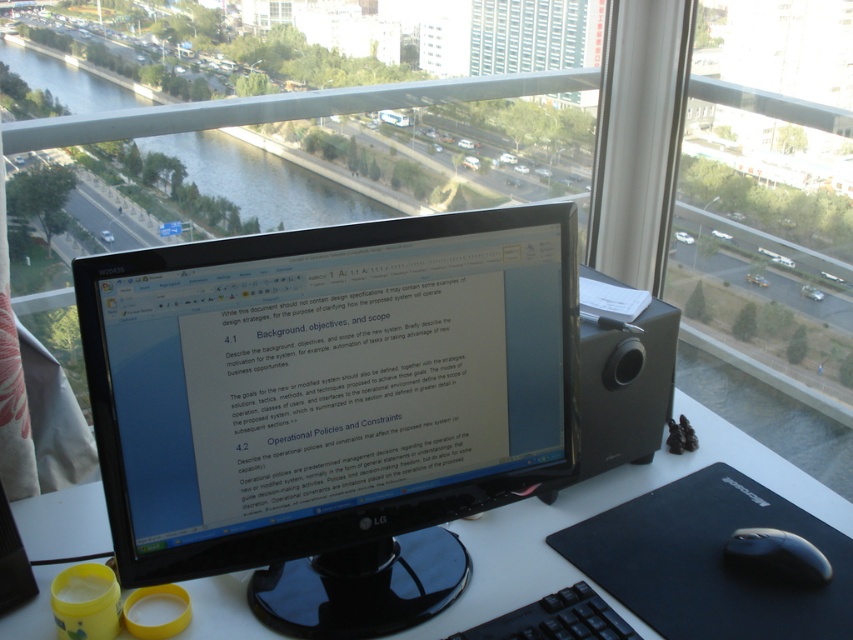
Is transparent glass window at upper center shorter than black matte mouse at lower right?

No.

Who is lower down, transparent glass window at upper center or black matte mouse at lower right?

black matte mouse at lower right

Identify the location of transparent glass window at upper center. (534, 35).

In the scene shown: Does black glossy monitor at center have a larger size compared to black matte mouse at lower right?

Yes, black glossy monitor at center is bigger than black matte mouse at lower right.

Is point (312, 330) farther from camera compared to point (752, 563)?

No, (312, 330) is closer to viewer.

Between point (294, 444) and point (780, 568), which one is positioned behind?

The point (780, 568) is behind.

This screenshot has width=853, height=640. I want to click on black glossy monitor at center, so click(x=329, y=404).

Can you confirm if white plastic computer desk at center is smaller than black plastic keyboard at lower center?

No, white plastic computer desk at center is not smaller than black plastic keyboard at lower center.

Is white plastic computer desk at center shorter than black plastic keyboard at lower center?

No, white plastic computer desk at center is not shorter than black plastic keyboard at lower center.

Between point (811, 488) and point (572, 621), which one is positioned in front?

Point (572, 621)

The height and width of the screenshot is (640, 853). I want to click on white plastic computer desk at center, so click(x=602, y=509).